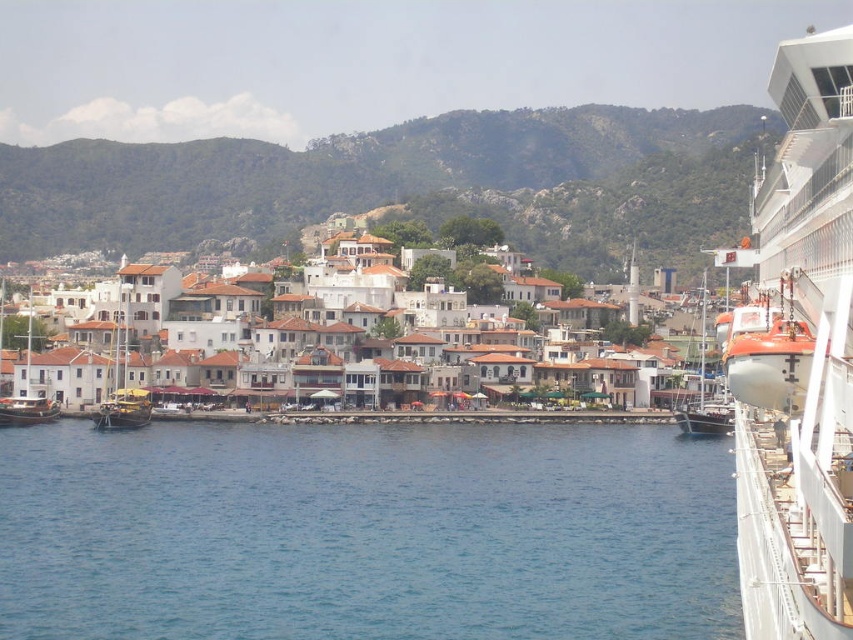
Question: Which object is the closest to the wooden sailboat at left?

Choices:
 (A) green grassy hillside at center
 (B) blue water at center
 (C) wooden sailboat at center
 (D) white matte buildings at center

Answer: (D)

Question: Can you confirm if white matte buildings at center is wider than wooden sailboat at center?

Choices:
 (A) no
 (B) yes

Answer: (B)

Question: Can you confirm if blue water at center is positioned to the right of white matte buildings at center?

Choices:
 (A) no
 (B) yes

Answer: (B)

Question: Estimate the real-world distances between objects in this image. Which object is farther from the wooden sailboat at center?

Choices:
 (A) wooden sailboat at lower left
 (B) white matte buildings at center
 (C) white glossy lifeboat at right

Answer: (A)

Question: Is white glossy lifeboat at right below white matte buildings at center?

Choices:
 (A) no
 (B) yes

Answer: (A)

Question: Among these objects, which one is farthest from the camera?

Choices:
 (A) wooden sailboat at center
 (B) white glossy lifeboat at right

Answer: (A)